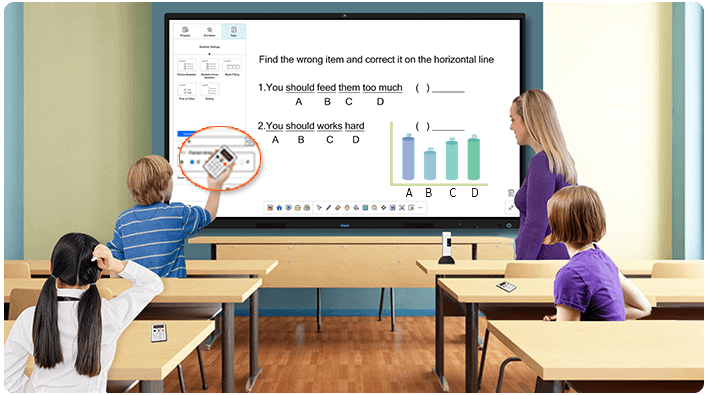
At what (x,y) coordinates should I click in order to perform the action: click on chair legs. Please return your answer as a coordinate pair (x, y). The image size is (707, 395). Looking at the image, I should click on (502, 371), (204, 370), (186, 384).